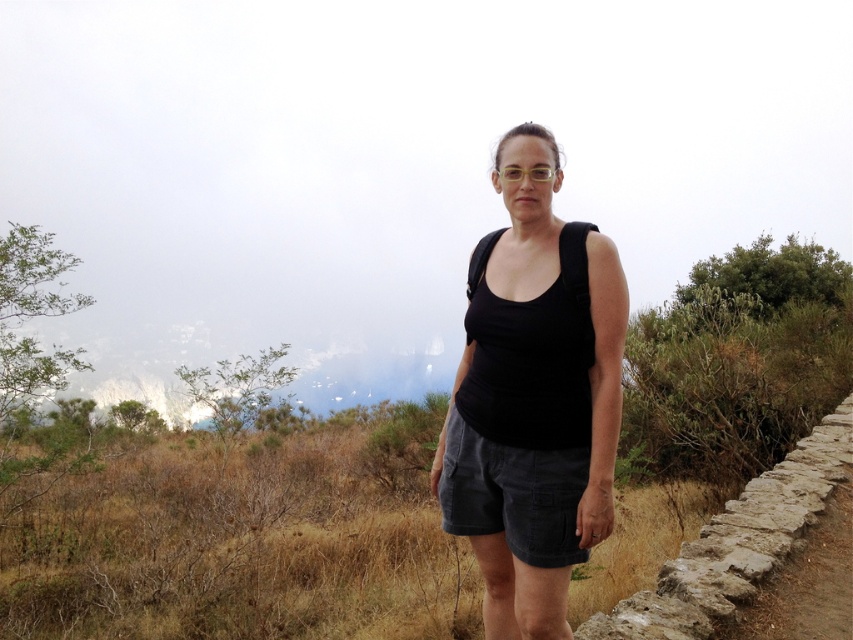
Between brown dry grass at lower center and black matte tank top at center, which one is positioned higher?

Positioned higher is black matte tank top at center.

You are a GUI agent. You are given a task and a screenshot of the screen. Output one action in this format:
    pyautogui.click(x=<x>, y=<y>)
    Task: Click on the brown dry grass at lower center
    The height and width of the screenshot is (640, 853).
    Given the screenshot: What is the action you would take?
    pyautogui.click(x=236, y=548)

This screenshot has height=640, width=853. I want to click on brown dry grass at lower center, so click(x=236, y=548).

Is brown dry grass at lower center to the right of dark gray corduroy shorts at center from the viewer's perspective?

No, brown dry grass at lower center is not to the right of dark gray corduroy shorts at center.

Is point (227, 508) positioned behind point (454, 490)?

Yes, point (227, 508) is farther from viewer.

The height and width of the screenshot is (640, 853). Describe the element at coordinates (236, 548) in the screenshot. I see `brown dry grass at lower center` at that location.

Identify the location of brown dry grass at lower center. (236, 548).

Between point (161, 561) and point (526, 307), which one is positioned in front?

Point (526, 307)

Based on the photo, measure the distance between brown dry grass at lower center and camera.

4.89 meters

Identify the location of brown dry grass at lower center. Image resolution: width=853 pixels, height=640 pixels. (236, 548).